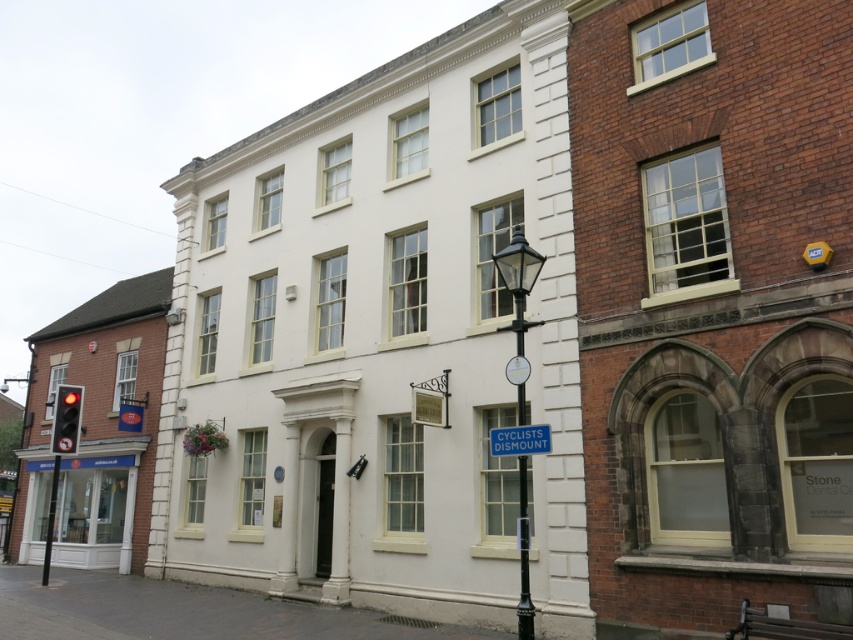
Question: Which point appears closest to the camera in this image?

Choices:
 (A) pyautogui.click(x=492, y=442)
 (B) pyautogui.click(x=521, y=563)
 (C) pyautogui.click(x=518, y=316)

Answer: (C)

Question: Can you confirm if black polished metal streetlamp at center is smaller than blue plastic sign at center?

Choices:
 (A) yes
 (B) no

Answer: (B)

Question: Is green metallic pole at center further to camera compared to blue plastic sign at center?

Choices:
 (A) yes
 (B) no

Answer: (A)

Question: Which of these objects is positioned farthest from the black polished metal streetlamp at center?

Choices:
 (A) green metallic pole at center
 (B) blue plastic sign at center

Answer: (B)

Question: Among these objects, which one is farthest from the camera?

Choices:
 (A) blue plastic sign at center
 (B) black polished metal streetlamp at center
 (C) green metallic pole at center

Answer: (B)

Question: Can you confirm if black polished metal streetlamp at center is wider than green metallic pole at center?

Choices:
 (A) yes
 (B) no

Answer: (A)